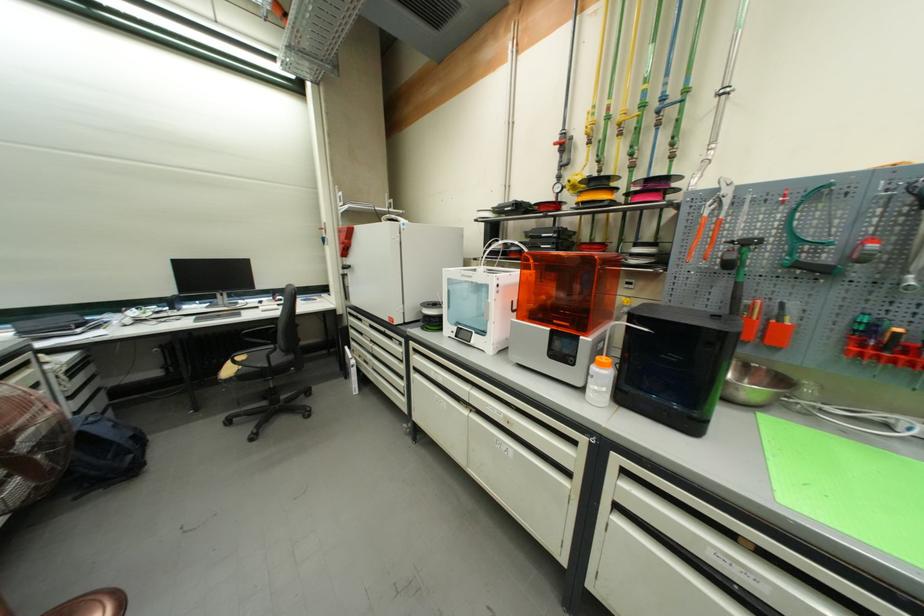
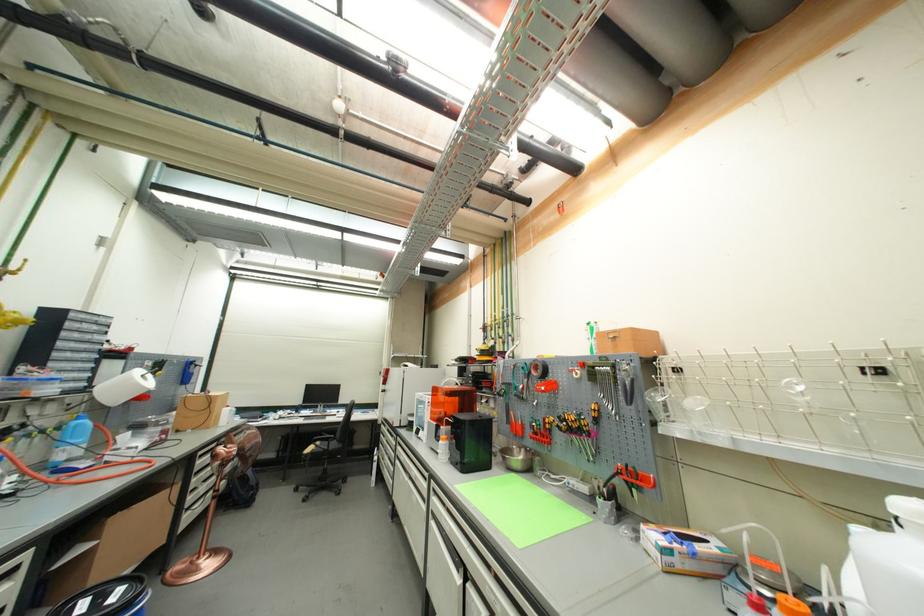
Locate, in the second image, the point that corresponds to (x=283, y=408) in the first image.

(330, 485)